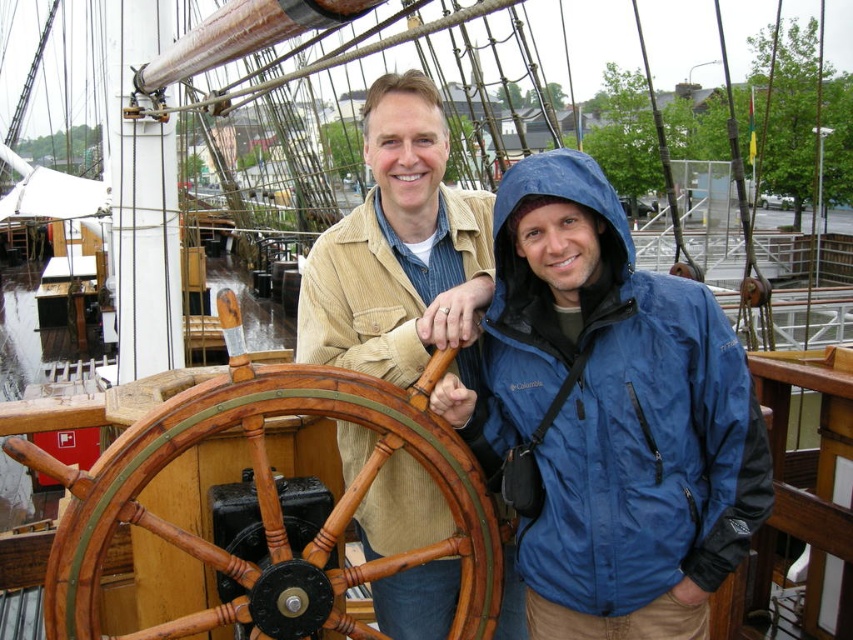
Question: Is wooden polished ship's wheel at center bigger than corduroy jacket at center?

Choices:
 (A) yes
 (B) no

Answer: (B)

Question: Which point is closer to the camera?

Choices:
 (A) wooden polished ship's wheel at center
 (B) corduroy jacket at center

Answer: (A)

Question: Can you confirm if wooden polished ship's wheel at center is positioned above corduroy jacket at center?

Choices:
 (A) no
 (B) yes

Answer: (A)

Question: Which of the following is the closest to the observer?

Choices:
 (A) corduroy jacket at center
 (B) wooden polished ship's wheel at center

Answer: (B)

Question: Which of the following is the closest to the observer?

Choices:
 (A) (407, 612)
 (B) (448, 541)

Answer: (B)

Question: Can you confirm if wooden polished ship's wheel at center is smaller than corduroy jacket at center?

Choices:
 (A) yes
 (B) no

Answer: (A)